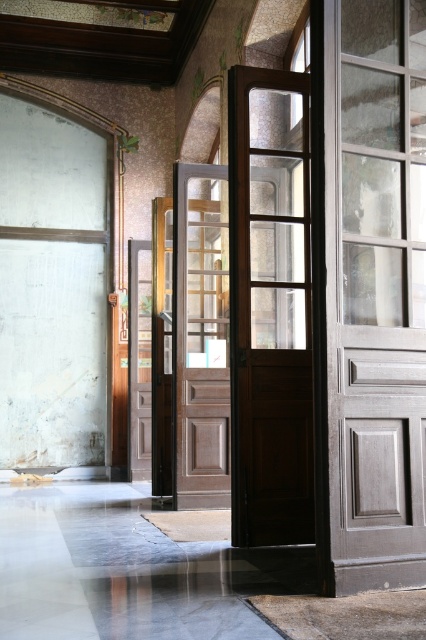
Question: Is the position of transparent glass door at center more distant than that of matte brown wooden door at center?

Choices:
 (A) yes
 (B) no

Answer: (B)

Question: Among these objects, which one is nearest to the camera?

Choices:
 (A) transparent glass door at center
 (B) matte brown wooden door at center
 (C) brown wooden door at center

Answer: (A)

Question: Which object appears closest to the camera in this image?

Choices:
 (A) transparent glass door at center
 (B) matte brown wooden door at center

Answer: (A)

Question: Can you confirm if transparent glass door at center is positioned to the left of matte brown wooden door at center?

Choices:
 (A) yes
 (B) no

Answer: (B)

Question: Is matte brown wooden door at center thinner than brown wooden door at center?

Choices:
 (A) no
 (B) yes

Answer: (A)

Question: Estimate the real-world distances between objects in this image. Which object is farther from the brown wooden door at center?

Choices:
 (A) transparent glass door at center
 (B) matte brown wooden door at center

Answer: (A)